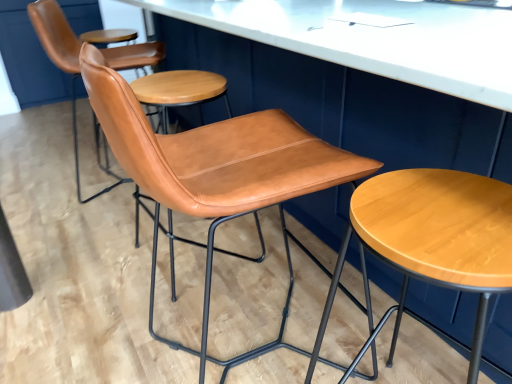
Describe the element at coordinates (434, 238) in the screenshot. I see `light brown wood stool at center` at that location.

What do you see at coordinates (179, 89) in the screenshot? I see `cognac leather chair at center, the second chair viewed from the front` at bounding box center [179, 89].

What are the coordinates of `cognac leather chair at center, marked as the 3th chair in a front-to-back arrangement` in the screenshot? It's located at (65, 67).

Considering the sizes of cognac leather chair at center, marked as the 1th chair in a back-to-front arrangement, and light brown wood stool at center in the image, is cognac leather chair at center, marked as the 1th chair in a back-to-front arrangement, wider or thinner than light brown wood stool at center?

Considering their sizes, cognac leather chair at center, marked as the 1th chair in a back-to-front arrangement, looks broader than light brown wood stool at center.

From a real-world perspective, which chair is the 2nd one above the light brown wood stool at center? Please provide its 2D coordinates.

[(65, 67)]

Considering the relative sizes of cognac leather chair at center, marked as the 3th chair in a front-to-back arrangement, and light brown wood stool at center in the image provided, is cognac leather chair at center, marked as the 3th chair in a front-to-back arrangement, shorter than light brown wood stool at center?

Incorrect, the height of cognac leather chair at center, marked as the 3th chair in a front-to-back arrangement, does not fall short of that of light brown wood stool at center.

Who is bigger, cognac leather chair at center, marked as the 3th chair in a front-to-back arrangement, or light brown wood stool at center?

With larger size is cognac leather chair at center, marked as the 3th chair in a front-to-back arrangement.

Is point (44, 14) more distant than point (99, 160)?

No, it is not.

Which object is positioned more to the left, cognac leather chair at center, marked as the 3th chair in a front-to-back arrangement, or cognac leather chair at center, the 2th chair when ordered from back to front?

cognac leather chair at center, marked as the 3th chair in a front-to-back arrangement, is more to the left.

Is cognac leather chair at center, marked as the 3th chair in a front-to-back arrangement, positioned beyond the bounds of cognac leather chair at center, the second chair viewed from the front?

Yes.

Is cognac leather chair at center, marked as the 3th chair in a front-to-back arrangement, in front of or behind cognac leather chair at center, the second chair viewed from the front, in the image?

cognac leather chair at center, marked as the 3th chair in a front-to-back arrangement, is behind cognac leather chair at center, the second chair viewed from the front.

Where is `stool that is under the cognac leather chair at center, the second chair viewed from the front (from a real-world perspective)`? The width and height of the screenshot is (512, 384). stool that is under the cognac leather chair at center, the second chair viewed from the front (from a real-world perspective) is located at coordinates (434, 238).

In the scene shown: Is cognac leather chair at center, the second chair viewed from the front, next to light brown wood stool at center?

They are not placed beside each other.

From a real-world perspective, is cognac leather chair at center, the second chair viewed from the front, above or below light brown wood stool at center?

Clearly, from a real-world perspective, cognac leather chair at center, the second chair viewed from the front, is above light brown wood stool at center.

Considering the relative sizes of cognac leather chair at center, the second chair viewed from the front, and light brown wood stool at center in the image provided, is cognac leather chair at center, the second chair viewed from the front, smaller than light brown wood stool at center?

Actually, cognac leather chair at center, the second chair viewed from the front, might be larger than light brown wood stool at center.

Considering the points (434, 184) and (143, 48), which point is in front, point (434, 184) or point (143, 48)?

Point (434, 184)

Which of these two, light brown wood stool at center or cognac leather chair at center, the 2th chair when ordered from back to front, is smaller?

Smaller between the two is light brown wood stool at center.

From a real-world perspective, is light brown wood stool at center physically above cognac leather chair at center, the second chair viewed from the front?

No, from a real-world perspective, light brown wood stool at center is not on top of cognac leather chair at center, the second chair viewed from the front.

Consider the image. From a real-world perspective, between cognac leather chair at center, the 2th chair when ordered from back to front, and cognac leather chair at center, which is counted as the 3th chair, starting from the back, who is vertically higher?

cognac leather chair at center, which is counted as the 3th chair, starting from the back.

Is cognac leather chair at center, the second chair viewed from the front, directly adjacent to cognac leather chair at center, which is counted as the 3th chair, starting from the back?

No, cognac leather chair at center, the second chair viewed from the front, is not with cognac leather chair at center, which is counted as the 3th chair, starting from the back.

Which is closer, (78, 63) or (257, 172)?

Point (78, 63) is closer to the camera than point (257, 172).

Looking at this image, considering the relative sizes of cognac leather chair at center, the second chair viewed from the front, and cognac leather chair at center, arranged as the 1th chair when viewed from the front, in the image provided, is cognac leather chair at center, the second chair viewed from the front, thinner than cognac leather chair at center, arranged as the 1th chair when viewed from the front,?

Correct, the width of cognac leather chair at center, the second chair viewed from the front, is less than that of cognac leather chair at center, arranged as the 1th chair when viewed from the front.

Between point (179, 179) and point (55, 17), which one is positioned in front?

The point (179, 179) is more forward.

What's the angular difference between cognac leather chair at center, arranged as the 1th chair when viewed from the front, and cognac leather chair at center, marked as the 3th chair in a front-to-back arrangement,'s facing directions?

2.24 degrees separate the facing orientations of cognac leather chair at center, arranged as the 1th chair when viewed from the front, and cognac leather chair at center, marked as the 3th chair in a front-to-back arrangement.

From the image's perspective, is cognac leather chair at center, which is counted as the 3th chair, starting from the back, on top of cognac leather chair at center, marked as the 3th chair in a front-to-back arrangement?

Incorrect, from the image's perspective, cognac leather chair at center, which is counted as the 3th chair, starting from the back, is lower than cognac leather chair at center, marked as the 3th chair in a front-to-back arrangement.

Considering the relative positions of cognac leather chair at center, which is counted as the 3th chair, starting from the back, and cognac leather chair at center, marked as the 3th chair in a front-to-back arrangement, in the image provided, is cognac leather chair at center, which is counted as the 3th chair, starting from the back, to the right of cognac leather chair at center, marked as the 3th chair in a front-to-back arrangement, from the viewer's perspective?

Yes.

From a real-world perspective, relative to cognac leather chair at center, marked as the 3th chair in a front-to-back arrangement, is cognac leather chair at center, the second chair viewed from the front, vertically above or below?

cognac leather chair at center, the second chair viewed from the front, is below cognac leather chair at center, marked as the 3th chair in a front-to-back arrangement.

Is cognac leather chair at center, the 2th chair when ordered from back to front, far from cognac leather chair at center, marked as the 3th chair in a front-to-back arrangement?

That's not correct — cognac leather chair at center, the 2th chair when ordered from back to front, is a little close to cognac leather chair at center, marked as the 3th chair in a front-to-back arrangement.

What's the angular difference between cognac leather chair at center, the second chair viewed from the front, and cognac leather chair at center, marked as the 1th chair in a back-to-front arrangement,'s facing directions?

4.63 degrees separate the facing orientations of cognac leather chair at center, the second chair viewed from the front, and cognac leather chair at center, marked as the 1th chair in a back-to-front arrangement.

Is cognac leather chair at center, the second chair viewed from the front, looking in the opposite direction of cognac leather chair at center, marked as the 1th chair in a back-to-front arrangement?

No.

Where is `stool that appears on the right of cognac leather chair at center, marked as the 1th chair in a back-to-front arrangement`? The height and width of the screenshot is (384, 512). stool that appears on the right of cognac leather chair at center, marked as the 1th chair in a back-to-front arrangement is located at coordinates tap(434, 238).

Locate an element on the screen. chair behind the cognac leather chair at center, the 2th chair when ordered from back to front is located at coordinates (65, 67).

Based on their spatial positions, is cognac leather chair at center, the 2th chair when ordered from back to front, or light brown wood stool at center closer to cognac leather chair at center, which is counted as the 3th chair, starting from the back?

Based on the image, light brown wood stool at center appears to be nearer to cognac leather chair at center, which is counted as the 3th chair, starting from the back.

Looking at the image, which one is located closer to light brown wood stool at center, cognac leather chair at center, marked as the 1th chair in a back-to-front arrangement, or cognac leather chair at center, the second chair viewed from the front?

cognac leather chair at center, marked as the 1th chair in a back-to-front arrangement, is positioned closer to the anchor light brown wood stool at center.

Estimate the real-world distances between objects in this image. Which object is further from cognac leather chair at center, the 2th chair when ordered from back to front, cognac leather chair at center, which is counted as the 3th chair, starting from the back, or light brown wood stool at center?

light brown wood stool at center.

When comparing their distances from cognac leather chair at center, marked as the 1th chair in a back-to-front arrangement, does cognac leather chair at center, arranged as the 1th chair when viewed from the front, or light brown wood stool at center seem further?

light brown wood stool at center.

When comparing their distances from cognac leather chair at center, arranged as the 1th chair when viewed from the front, does cognac leather chair at center, marked as the 1th chair in a back-to-front arrangement, or cognac leather chair at center, the second chair viewed from the front, seem further?

cognac leather chair at center, marked as the 1th chair in a back-to-front arrangement, is further to cognac leather chair at center, arranged as the 1th chair when viewed from the front.

Which object lies nearer to the anchor point light brown wood stool at center, cognac leather chair at center, arranged as the 1th chair when viewed from the front, or cognac leather chair at center, marked as the 1th chair in a back-to-front arrangement?

cognac leather chair at center, arranged as the 1th chair when viewed from the front, is positioned closer to the anchor light brown wood stool at center.

Looking at the image, which one is located further to cognac leather chair at center, marked as the 1th chair in a back-to-front arrangement, cognac leather chair at center, the 2th chair when ordered from back to front, or light brown wood stool at center?

light brown wood stool at center lies further to cognac leather chair at center, marked as the 1th chair in a back-to-front arrangement, than the other object.

From the image, which object appears to be nearer to cognac leather chair at center, which is counted as the 3th chair, starting from the back, cognac leather chair at center, the second chair viewed from the front, or cognac leather chair at center, marked as the 3th chair in a front-to-back arrangement?

The object closer to cognac leather chair at center, which is counted as the 3th chair, starting from the back, is cognac leather chair at center, the second chair viewed from the front.

At what (x,y) coordinates should I click in order to perform the action: click on chair positioned between light brown wood stool at center and cognac leather chair at center, the 2th chair when ordered from back to front, from near to far. Please return your answer as a coordinate pair (x, y). Looking at the image, I should click on (216, 175).

Find the location of a particular element. This screenshot has height=384, width=512. chair between cognac leather chair at center, arranged as the 1th chair when viewed from the front, and cognac leather chair at center, marked as the 3th chair in a front-to-back arrangement, in the front-back direction is located at coordinates (179, 89).